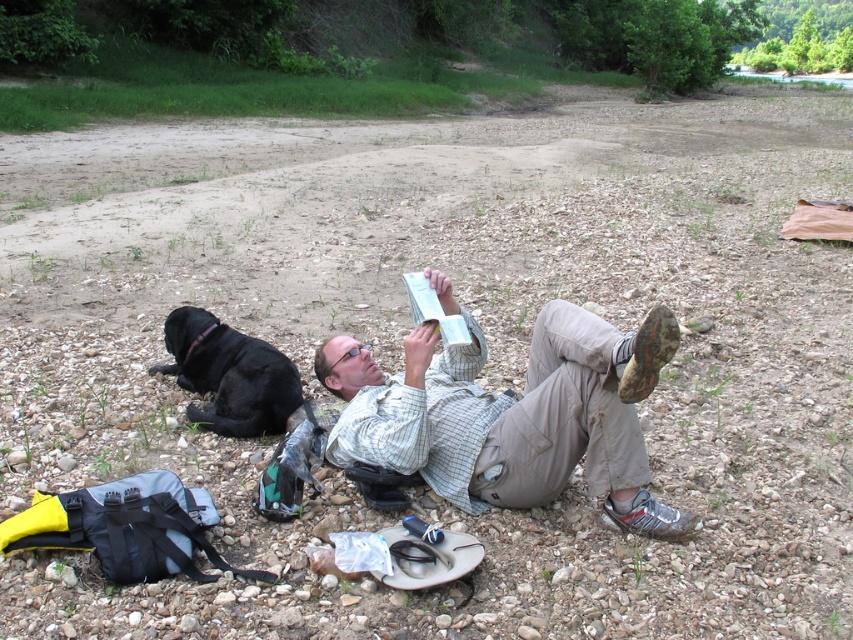
Does light brown cotton shirt at center have a greater height compared to black fur dog at lower left?

Correct, light brown cotton shirt at center is much taller as black fur dog at lower left.

Is point (454, 376) positioned behind point (250, 412)?

No, it is not.

Is point (605, 488) in front of point (218, 344)?

Yes, point (605, 488) is in front of point (218, 344).

Where is `light brown cotton shirt at center`? light brown cotton shirt at center is located at coordinates (509, 413).